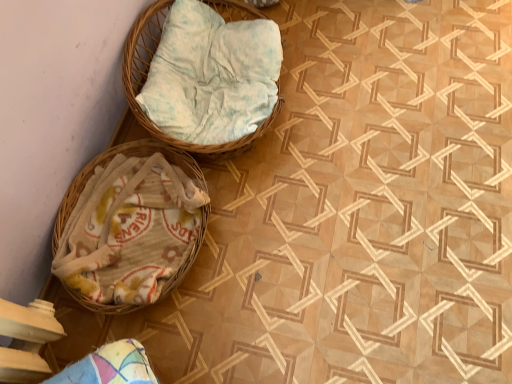
Question: Is woven wicker basket at upper center, the first basket positioned from the top, surrounding white woven basket at left, which appears as the 1th basket when ordered from the bottom?

Choices:
 (A) yes
 (B) no

Answer: (B)

Question: Is woven wicker basket at upper center, the first basket positioned from the top, next to white woven basket at left, which appears as the 1th basket when ordered from the bottom, and touching it?

Choices:
 (A) yes
 (B) no

Answer: (B)

Question: From the image's perspective, would you say woven wicker basket at upper center, the first basket positioned from the top, is shown under white woven basket at left, which appears as the 1th basket when ordered from the bottom?

Choices:
 (A) no
 (B) yes

Answer: (A)

Question: Can you confirm if woven wicker basket at upper center, the first basket positioned from the top, is positioned to the right of white woven basket at left, which appears as the 1th basket when ordered from the bottom?

Choices:
 (A) no
 (B) yes

Answer: (B)

Question: From the image's perspective, is woven wicker basket at upper center, the first basket positioned from the top, above white woven basket at left, which appears as the 1th basket when ordered from the bottom?

Choices:
 (A) no
 (B) yes

Answer: (B)

Question: Is woven wicker basket at upper center, the first basket positioned from the top, bigger than white woven basket at left, which appears as the 2th basket when viewed from the top?

Choices:
 (A) no
 (B) yes

Answer: (B)

Question: From a real-world perspective, is white woven basket at left, which appears as the 2th basket when viewed from the top, on top of woven wicker basket at upper center, marked as the 2th basket in a bottom-to-top arrangement?

Choices:
 (A) no
 (B) yes

Answer: (A)

Question: Could you tell me if white woven basket at left, which appears as the 1th basket when ordered from the bottom, is turned towards woven wicker basket at upper center, the first basket positioned from the top?

Choices:
 (A) no
 (B) yes

Answer: (A)

Question: Does white woven basket at left, which appears as the 1th basket when ordered from the bottom, touch woven wicker basket at upper center, marked as the 2th basket in a bottom-to-top arrangement?

Choices:
 (A) yes
 (B) no

Answer: (B)

Question: Considering the relative positions of white woven basket at left, which appears as the 1th basket when ordered from the bottom, and woven wicker basket at upper center, the first basket positioned from the top, in the image provided, is white woven basket at left, which appears as the 1th basket when ordered from the bottom, to the right of woven wicker basket at upper center, the first basket positioned from the top, from the viewer's perspective?

Choices:
 (A) no
 (B) yes

Answer: (A)

Question: Is woven wicker basket at upper center, marked as the 2th basket in a bottom-to-top arrangement, a part of white woven basket at left, which appears as the 1th basket when ordered from the bottom?

Choices:
 (A) yes
 (B) no

Answer: (B)

Question: Does white woven basket at left, which appears as the 2th basket when viewed from the top, have a greater height compared to woven wicker basket at upper center, the first basket positioned from the top?

Choices:
 (A) yes
 (B) no

Answer: (B)

Question: Considering the positions of woven wicker basket at upper center, marked as the 2th basket in a bottom-to-top arrangement, and white woven basket at left, which appears as the 1th basket when ordered from the bottom, in the image, is woven wicker basket at upper center, marked as the 2th basket in a bottom-to-top arrangement, bigger or smaller than white woven basket at left, which appears as the 1th basket when ordered from the bottom,?

Choices:
 (A) small
 (B) big

Answer: (B)